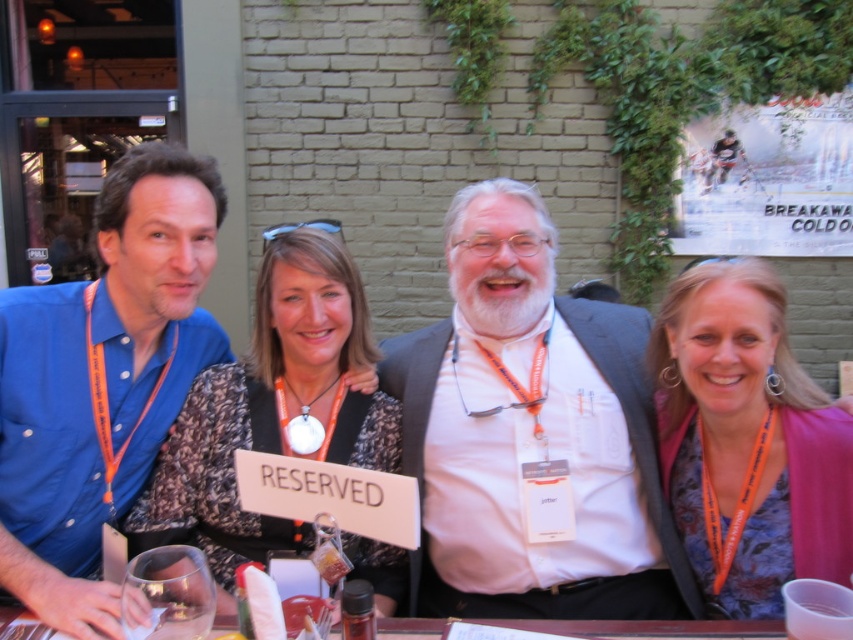
Does blue cotton shirt at left have a greater width compared to speckled fabric dress at center?

In fact, blue cotton shirt at left might be narrower than speckled fabric dress at center.

Is point (190, 358) farther from camera compared to point (347, 273)?

Yes, point (190, 358) is farther from viewer.

Find the location of a particular element. This screenshot has width=853, height=640. blue cotton shirt at left is located at coordinates (102, 380).

In the scene shown: Who is positioned more to the left, pink floral blouse at center or speckled fabric dress at center?

Positioned to the left is speckled fabric dress at center.

The width and height of the screenshot is (853, 640). What do you see at coordinates (747, 442) in the screenshot? I see `pink floral blouse at center` at bounding box center [747, 442].

Image resolution: width=853 pixels, height=640 pixels. Identify the location of pink floral blouse at center. (747, 442).

Image resolution: width=853 pixels, height=640 pixels. In order to click on pink floral blouse at center in this screenshot , I will do `click(747, 442)`.

Between blue cotton shirt at left and clear glass table at center, which one appears on the right side from the viewer's perspective?

clear glass table at center is more to the right.

Locate an element on the screen. This screenshot has width=853, height=640. blue cotton shirt at left is located at coordinates (102, 380).

Locate an element on the screen. The image size is (853, 640). blue cotton shirt at left is located at coordinates (102, 380).